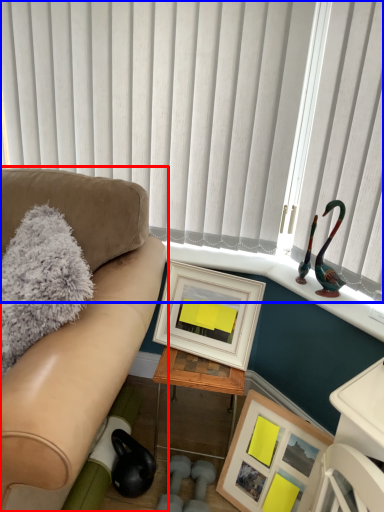
Question: Which point is closer to the camera, studio couch (highlighted by a red box) or window blind (highlighted by a blue box)?

Choices:
 (A) studio couch
 (B) window blind

Answer: (A)